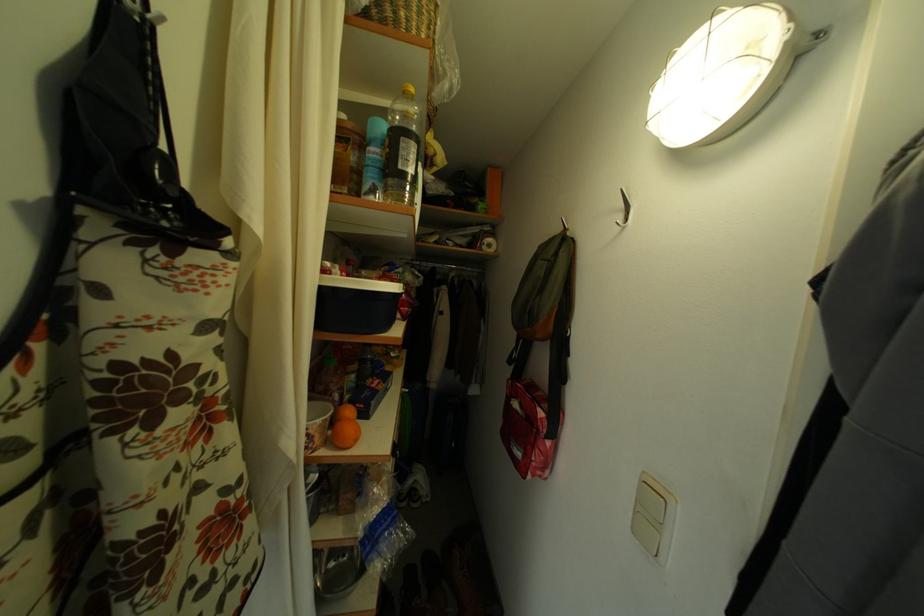
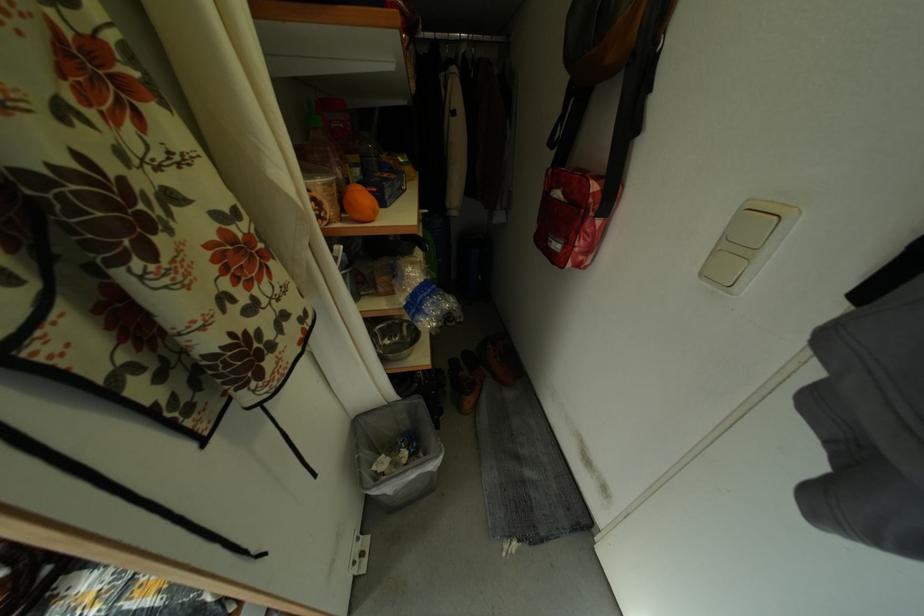
Locate, in the second image, the point that corresponds to point 350,408 in the first image.

(357, 188)